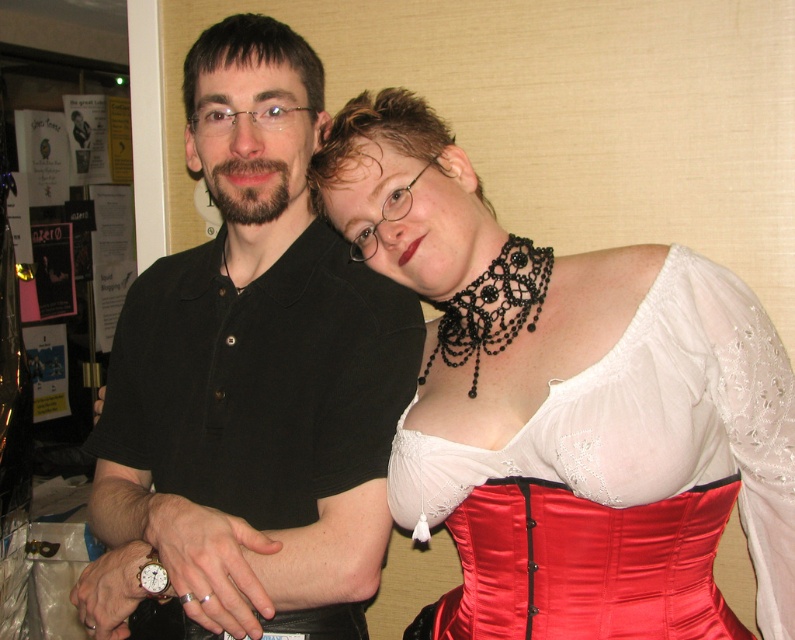
Where is the black matte shirt at center located in the image?

The black matte shirt at center is located at point (256, 369).

You are a photographer setting up a shoot in a studio. You have two main subjects wearing the black matte shirt at center and the satin red corset at center. You want to ensure that both subjects are equally visible in the final photo. Given their positions relative to the camera, which subject might need to be moved closer to the camera to balance their visibility?

The satin red corset at center is farther from the viewer than the black matte shirt at center. To balance visibility, the satin red corset at center should be moved closer to the camera so both are at the same distance from the camera.